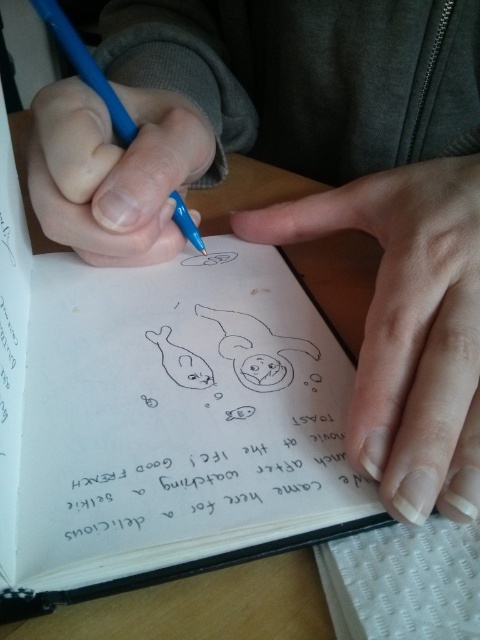
Question: Which of these objects is positioned closest to the nail polish at upper right?

Choices:
 (A) white textured notepad at lower right
 (B) blue plastic pen at upper left
 (C) black paper text at center
 (D) matte blue pencil at center

Answer: (C)

Question: Can you confirm if nail polish at upper right is positioned to the left of matte blue pencil at center?

Choices:
 (A) yes
 (B) no

Answer: (B)

Question: Is nail polish at upper right closer to the viewer compared to black paper text at center?

Choices:
 (A) no
 (B) yes

Answer: (A)

Question: Which object is closer to the camera taking this photo?

Choices:
 (A) nail polish at upper right
 (B) matte blue pencil at center

Answer: (A)

Question: Does nail polish at upper right appear on the left side of blue plastic pen at upper left?

Choices:
 (A) yes
 (B) no

Answer: (B)

Question: Which of these objects is positioned farthest from the white textured notepad at lower right?

Choices:
 (A) nail polish at upper right
 (B) matte blue pencil at center
 (C) blue plastic pen at upper left

Answer: (C)